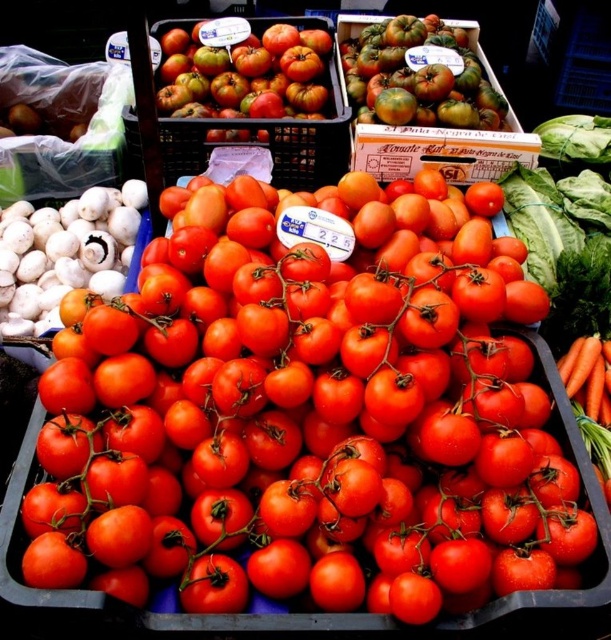
Question: Can you confirm if shiny red tomatoes at center is smaller than greenish matte tomatoes at upper center?

Choices:
 (A) yes
 (B) no

Answer: (B)

Question: Which point is closer to the camera taking this photo?

Choices:
 (A) (131, 193)
 (B) (384, 51)

Answer: (B)

Question: Can you confirm if shiny red tomatoes at center is wider than rustic matte tomatoes at upper center?

Choices:
 (A) no
 (B) yes

Answer: (B)

Question: Can you confirm if shiny red tomatoes at center is wider than rustic matte tomatoes at upper center?

Choices:
 (A) yes
 (B) no

Answer: (A)

Question: Which point is closer to the camera taking this photo?

Choices:
 (A) (62, 269)
 (B) (351, 84)

Answer: (A)

Question: Based on their relative distances, which object is farther from the shiny red tomatoes at center?

Choices:
 (A) rustic matte tomatoes at upper center
 (B) greenish matte tomatoes at upper center

Answer: (A)